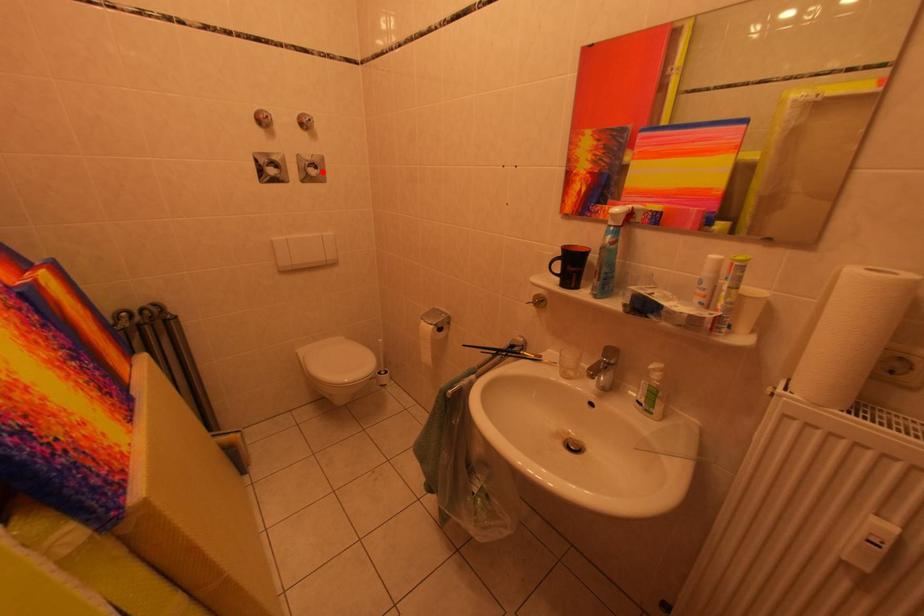
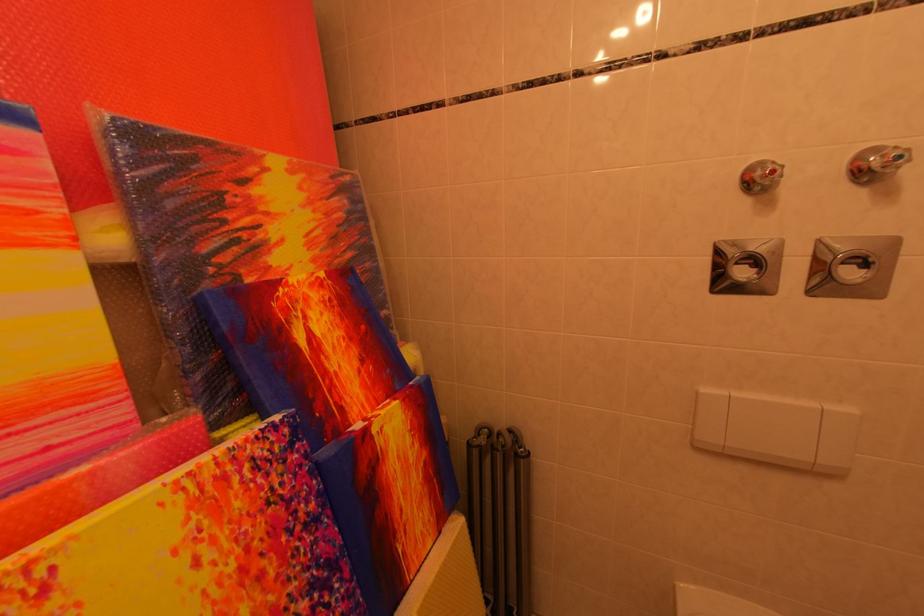
The point at the highlighted location is marked in the first image. Where is the corresponding point in the second image?

(864, 270)